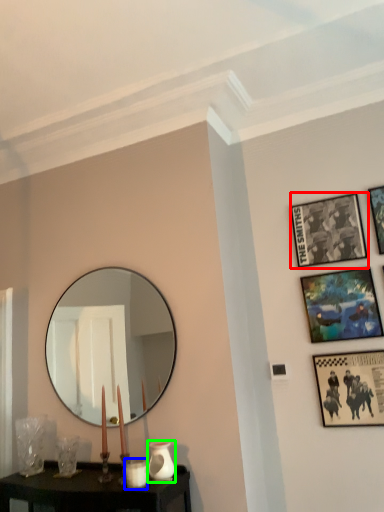
Question: Estimate the real-world distances between objects in this image. Which object is farther from picture frame (highlighted by a red box), candle holder (highlighted by a blue box) or vase (highlighted by a green box)?

Choices:
 (A) candle holder
 (B) vase

Answer: (A)